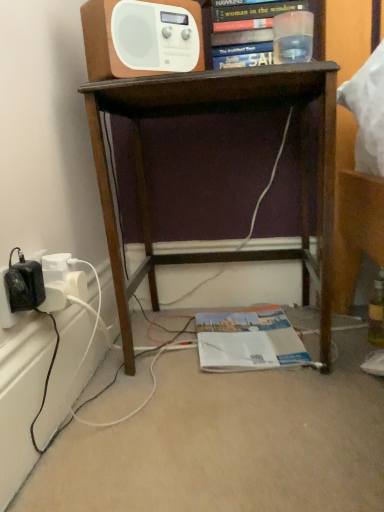
Question: Based on their sizes in the image, would you say brown wood desk at center is bigger or smaller than white glossy magazine at lower center?

Choices:
 (A) small
 (B) big

Answer: (B)

Question: Considering the positions of brown wood desk at center and white glossy magazine at lower center in the image, is brown wood desk at center wider or thinner than white glossy magazine at lower center?

Choices:
 (A) thin
 (B) wide

Answer: (B)

Question: Which is nearer to the brown wood desk at center?

Choices:
 (A) white glossy magazine at lower center
 (B) hardcover book at upper center
 (C) white plastic radio at upper center

Answer: (B)

Question: Which is farther from the white plastic radio at upper center?

Choices:
 (A) hardcover book at upper center
 (B) brown wood desk at center
 (C) white glossy magazine at lower center

Answer: (C)